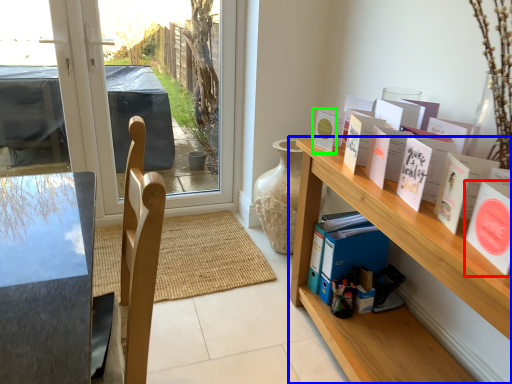
Question: Which object is positioned farthest from book (highlighted by a red box)? Select from shelf (highlighted by a blue box) and book (highlighted by a green box).

Choices:
 (A) shelf
 (B) book

Answer: (B)